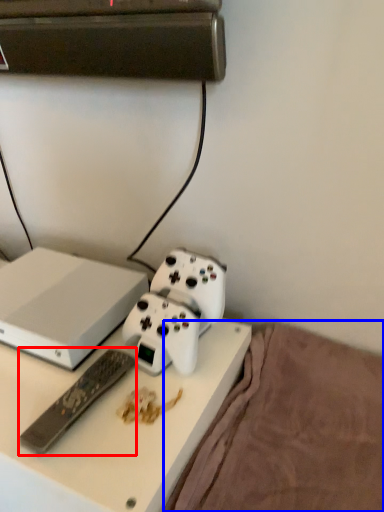
Question: Which point is further to the camera, remote control (highlighted by a red box) or bedding (highlighted by a blue box)?

Choices:
 (A) remote control
 (B) bedding

Answer: (A)